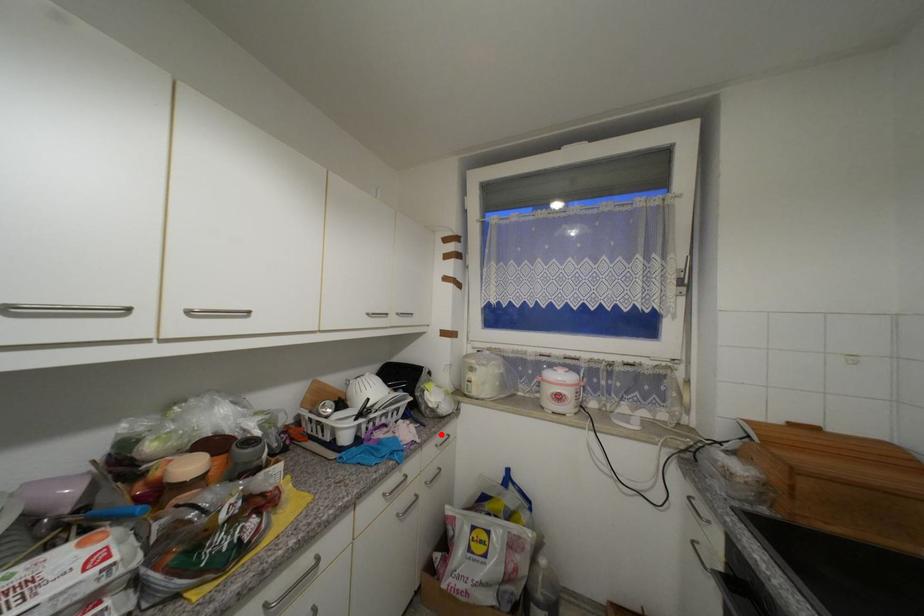
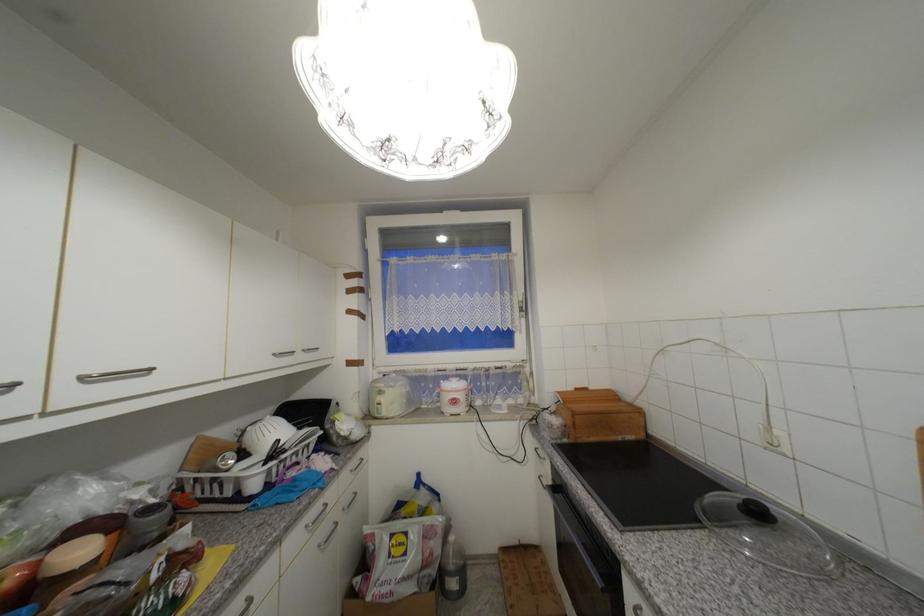
Locate, in the second image, the point that corresponds to the highlighted location in the first image.

(357, 460)